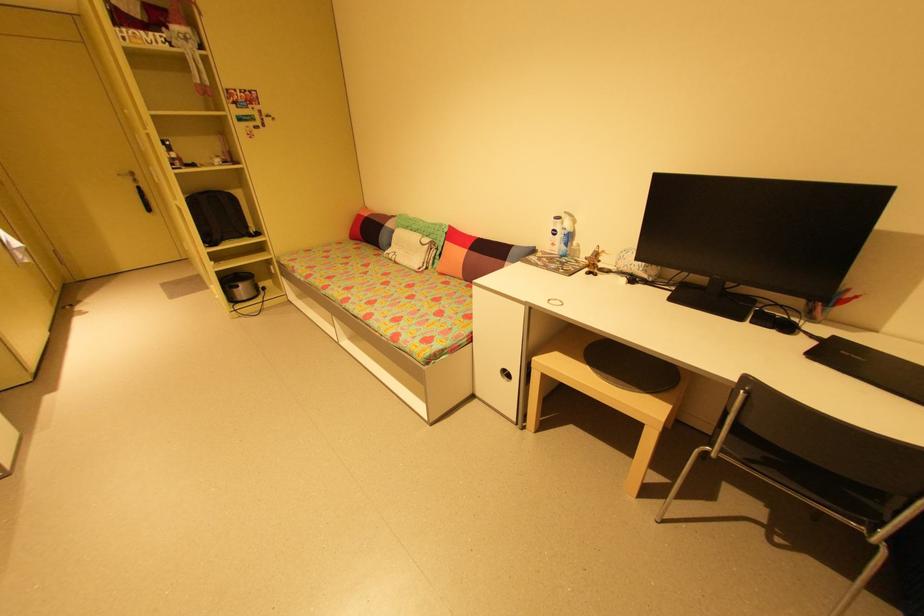
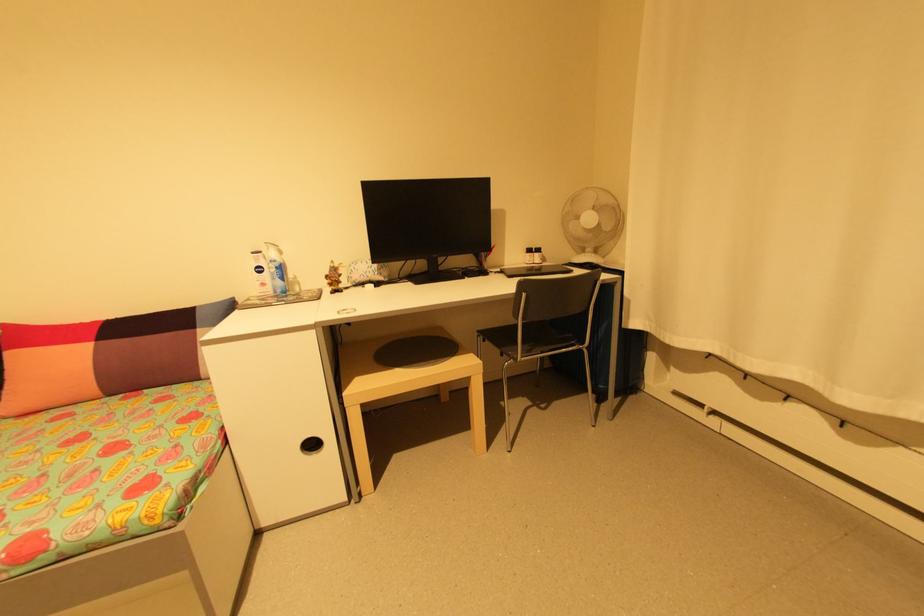
Question: Based on the continuous images, in which direction is the camera rotating? Reply with the corresponding letter.

Choices:
 (A) Left
 (B) Right
 (C) Up
 (D) Down

Answer: (B)